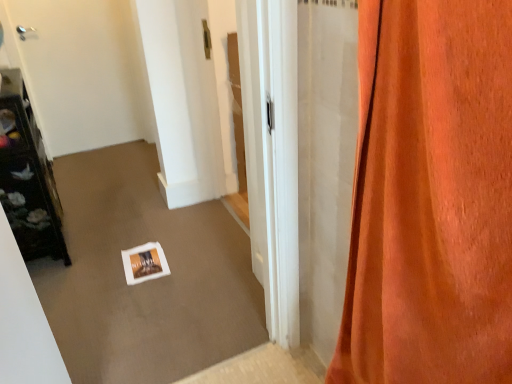
Question: Is dark brown wooden shelf at left to the right of orange velvet curtain at right from the viewer's perspective?

Choices:
 (A) yes
 (B) no

Answer: (B)

Question: Considering the relative sizes of dark brown wooden shelf at left and orange velvet curtain at right in the image provided, is dark brown wooden shelf at left bigger than orange velvet curtain at right?

Choices:
 (A) no
 (B) yes

Answer: (B)

Question: Is orange velvet curtain at right located within dark brown wooden shelf at left?

Choices:
 (A) no
 (B) yes

Answer: (A)

Question: From the image's perspective, is dark brown wooden shelf at left above orange velvet curtain at right?

Choices:
 (A) yes
 (B) no

Answer: (A)

Question: From a real-world perspective, does dark brown wooden shelf at left stand above orange velvet curtain at right?

Choices:
 (A) no
 (B) yes

Answer: (A)

Question: From the image's perspective, is white glossy door at upper left located above or below orange velvet curtain at right?

Choices:
 (A) above
 (B) below

Answer: (A)

Question: In terms of height, does white glossy door at upper left look taller or shorter compared to orange velvet curtain at right?

Choices:
 (A) tall
 (B) short

Answer: (B)

Question: Is white glossy door at upper left bigger or smaller than orange velvet curtain at right?

Choices:
 (A) big
 (B) small

Answer: (B)

Question: From a real-world perspective, is white glossy door at upper left physically located above or below orange velvet curtain at right?

Choices:
 (A) above
 (B) below

Answer: (B)

Question: Is white glossy door at upper left situated inside dark brown wooden shelf at left or outside?

Choices:
 (A) inside
 (B) outside

Answer: (B)

Question: Is white glossy door at upper left taller or shorter than dark brown wooden shelf at left?

Choices:
 (A) short
 (B) tall

Answer: (B)

Question: Considering the relative positions of white glossy door at upper left and dark brown wooden shelf at left in the image provided, is white glossy door at upper left to the left or to the right of dark brown wooden shelf at left?

Choices:
 (A) right
 (B) left

Answer: (B)

Question: Is point (36, 13) closer or farther from the camera than point (37, 167)?

Choices:
 (A) closer
 (B) farther

Answer: (B)

Question: Relative to dark brown wooden shelf at left, is orange velvet curtain at right in front or behind?

Choices:
 (A) behind
 (B) front

Answer: (B)

Question: From the image's perspective, is orange velvet curtain at right located above or below dark brown wooden shelf at left?

Choices:
 (A) above
 (B) below

Answer: (B)